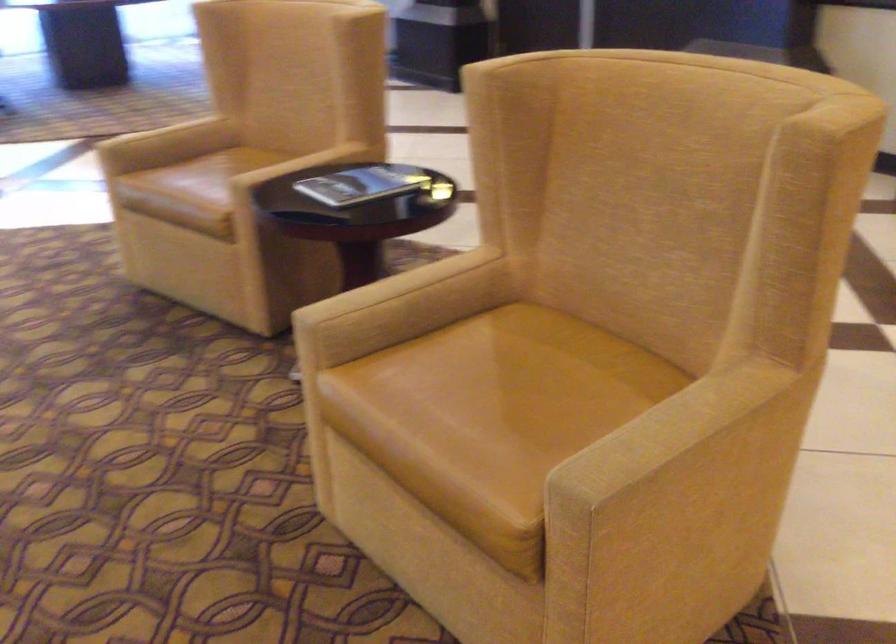
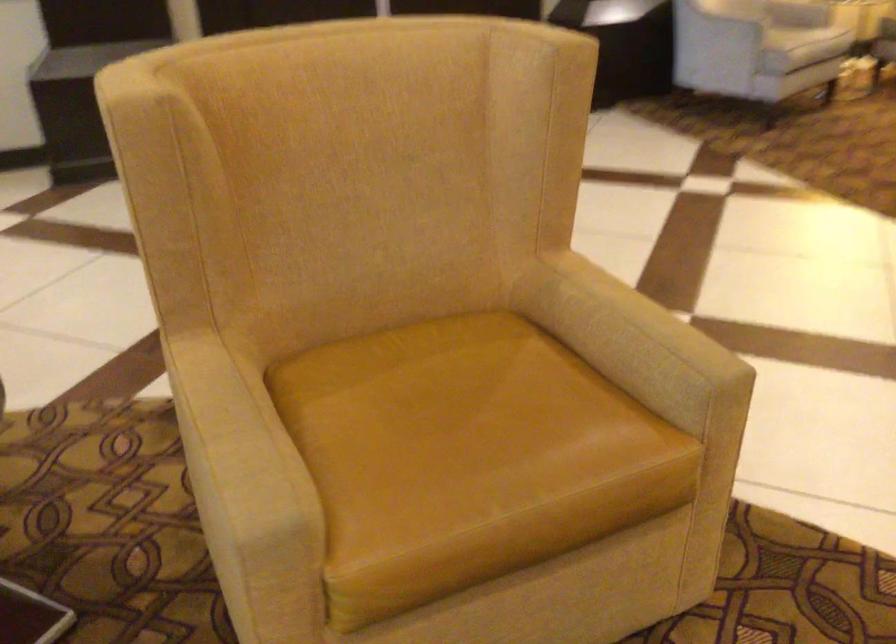
Find the pixel in the second image that matches point (494, 386) in the first image.

(452, 426)